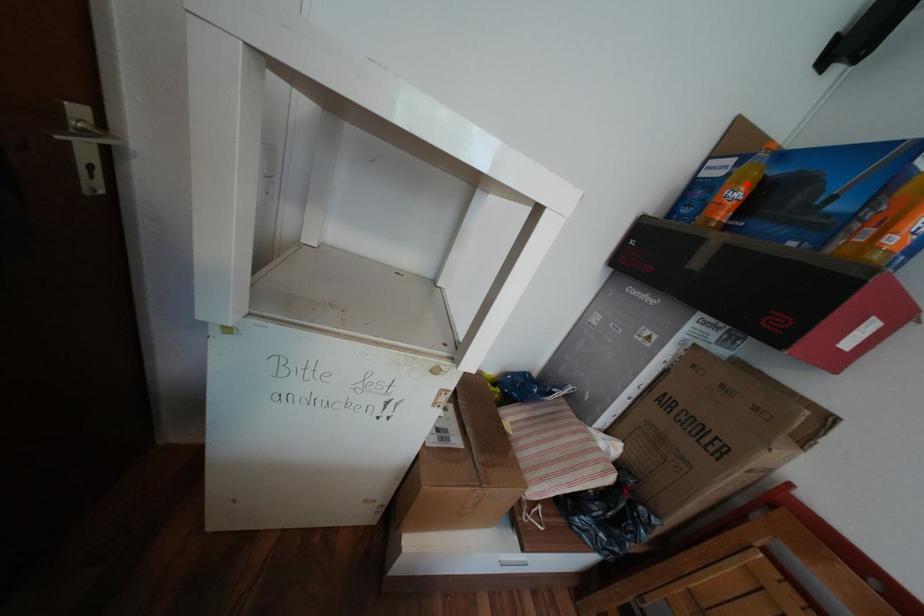
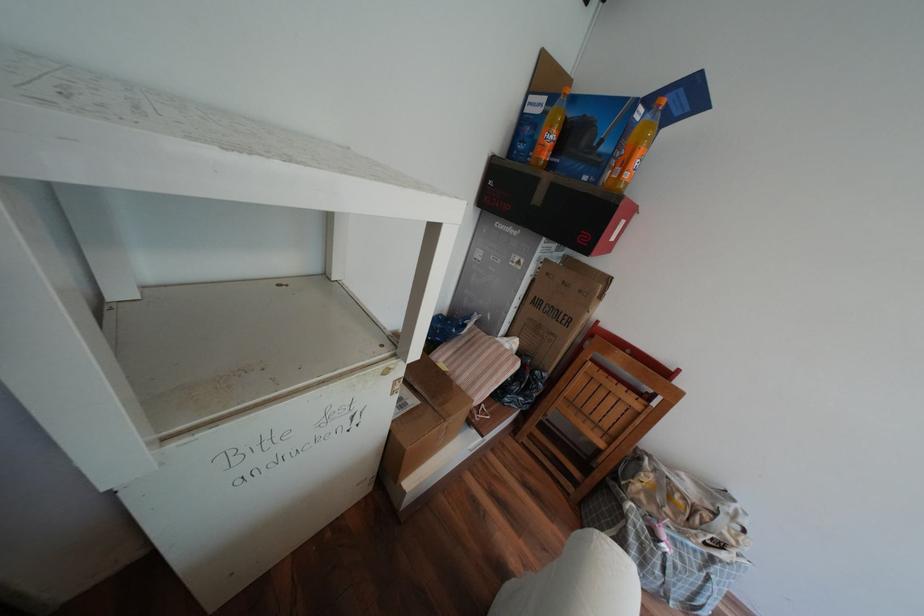
Locate, in the second image, the point that corresponds to the highlighted location in the first image.

(561, 127)